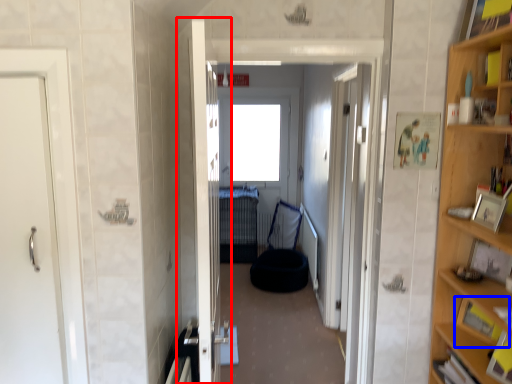
Question: Which object is further to the camera taking this photo, door (highlighted by a red box) or cabinet (highlighted by a blue box)?

Choices:
 (A) door
 (B) cabinet

Answer: (B)